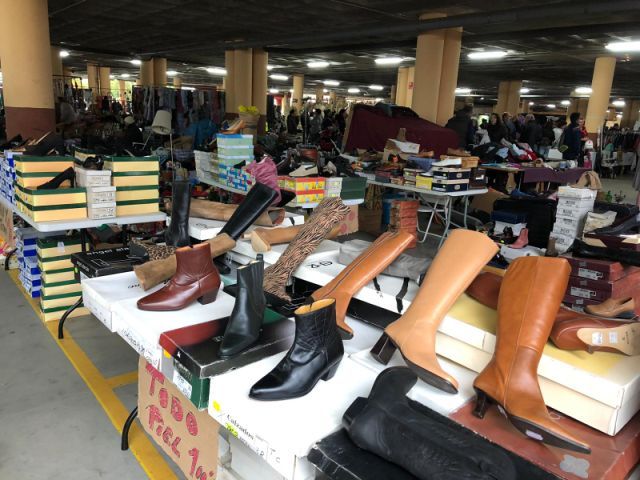
Where is `display table`? display table is located at coordinates (60, 326), (72, 224), (436, 195).